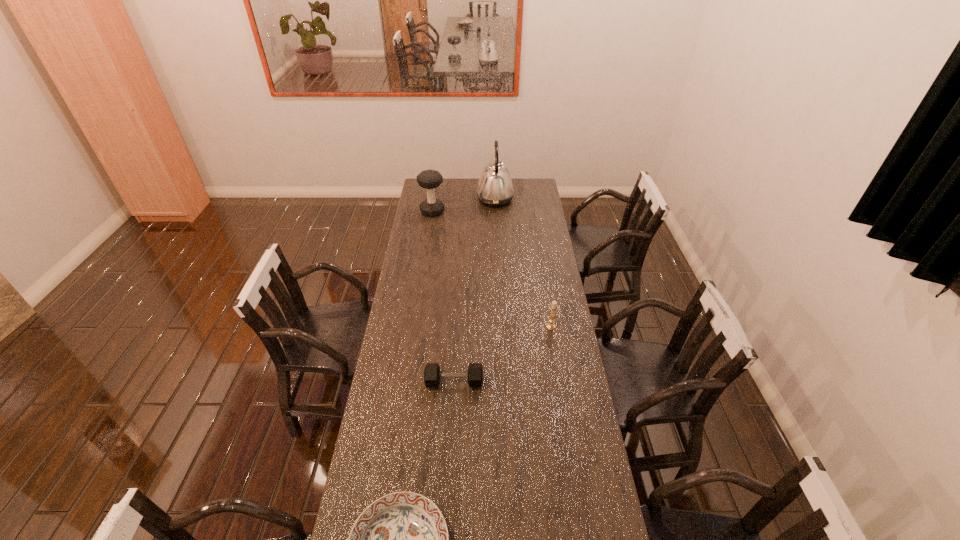
What are the coordinates of `vacant point located 0.140m on the right of the farther dumbbell` in the screenshot? It's located at (469, 212).

The image size is (960, 540). I want to click on free space located 0.200m on the front of the third tallest object, so click(x=558, y=369).

I want to click on free point located 0.240m on the right of the nearer dumbbell, so click(547, 382).

The height and width of the screenshot is (540, 960). In order to click on object positioned at the far edge in this screenshot , I will do `click(495, 188)`.

Locate an element on the screen. object located at the left edge is located at coordinates (430, 179).

The image size is (960, 540). I want to click on object at the right edge, so click(553, 307).

The height and width of the screenshot is (540, 960). In the image, there is a desktop. Find the location of `vacant space at the far edge`. vacant space at the far edge is located at coordinates (466, 191).

Where is `vacant area at the left edge`? The width and height of the screenshot is (960, 540). vacant area at the left edge is located at coordinates (423, 321).

Where is `free location at the right edge`? free location at the right edge is located at coordinates (550, 285).

Locate an element on the screen. The width and height of the screenshot is (960, 540). free space at the far right corner of the desktop is located at coordinates (524, 193).